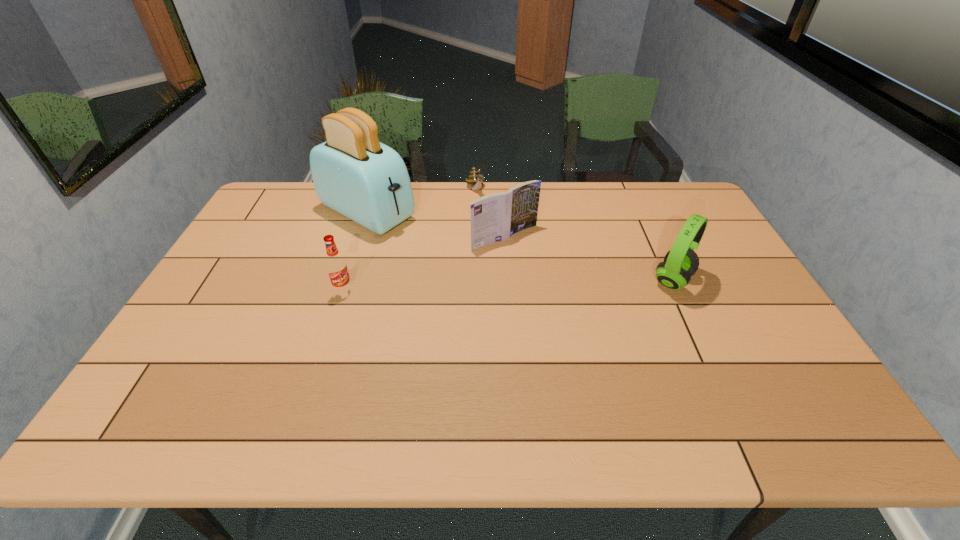
Find the location of `vacant area situated on the side of the tallest object with the lever`. vacant area situated on the side of the tallest object with the lever is located at coordinates (480, 270).

Locate an element on the screen. This screenshot has height=540, width=960. free space located 0.200m on the side of the tallest object with the lever is located at coordinates (449, 254).

Locate an element on the screen. The width and height of the screenshot is (960, 540). free location located 0.120m on the side of the tallest object with the lever is located at coordinates (430, 244).

At what (x,y) coordinates should I click in order to perform the action: click on free space located 0.090m on the front cover of the book. Please return your answer as a coordinate pair (x, y). This screenshot has height=540, width=960. Looking at the image, I should click on (541, 266).

You are a GUI agent. You are given a task and a screenshot of the screen. Output one action in this format:
    pyautogui.click(x=<x>, y=<y>)
    Task: Click on the vacant region located on the front cover of the book
    The height and width of the screenshot is (540, 960).
    Given the screenshot: What is the action you would take?
    pyautogui.click(x=567, y=289)

The width and height of the screenshot is (960, 540). I want to click on vacant space positioned on the front cover of the book, so click(584, 305).

Locate an element on the screen. This screenshot has height=540, width=960. snail positioned at the far edge is located at coordinates (474, 178).

What are the coordinates of `toaster that is positioned at the far edge` in the screenshot? It's located at (353, 173).

The width and height of the screenshot is (960, 540). I want to click on object present at the right edge, so coord(680,263).

At what (x,y) coordinates should I click in order to perform the action: click on vacant space at the far edge. Please return your answer as a coordinate pair (x, y). The height and width of the screenshot is (540, 960). Looking at the image, I should click on (525, 181).